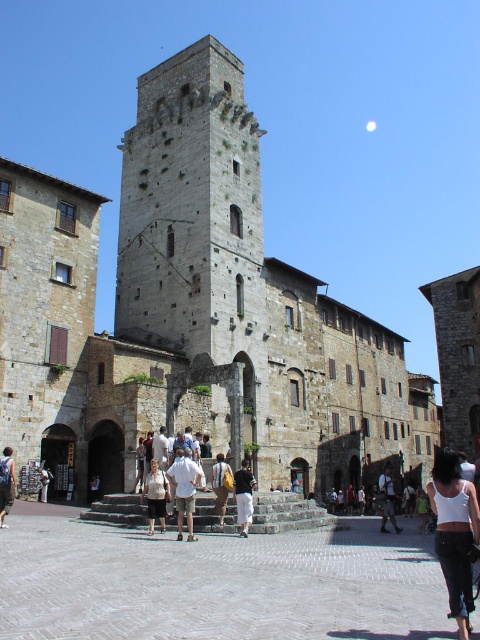
Question: Is matte white shirt at center wider than striped shirt at center?

Choices:
 (A) yes
 (B) no

Answer: (B)

Question: Does matte white shirt at center lie behind camouflage pants at lower center?

Choices:
 (A) no
 (B) yes

Answer: (A)

Question: Is gray stone pavement at lower center behind matte white shirt at center?

Choices:
 (A) no
 (B) yes

Answer: (A)

Question: Which object appears farthest from the camera in this image?

Choices:
 (A) white cotton tank top at lower right
 (B) gray stone pavement at lower center
 (C) black leather jacket at center
 (D) camouflage pants at lower center

Answer: (D)

Question: Which point is farther from the camera taking this photo?

Choices:
 (A) (388, 506)
 (B) (213, 481)
 (C) (165, 492)
 (D) (192, 540)

Answer: (A)

Question: Among these points, which one is nearest to the camera?

Choices:
 (A) (181, 536)
 (B) (388, 509)

Answer: (A)